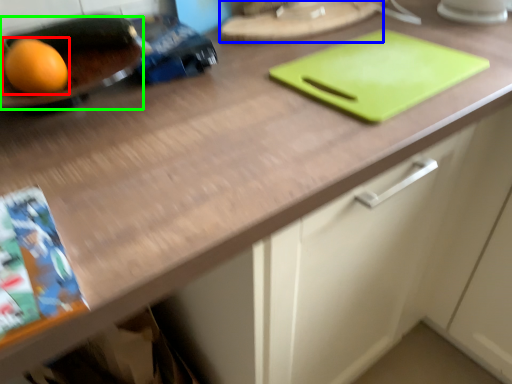
Question: Based on their relative distances, which object is farther from grapefruit (highlighted by a red box)? Choose from tray (highlighted by a blue box) and tray (highlighted by a green box).

Choices:
 (A) tray
 (B) tray

Answer: (A)